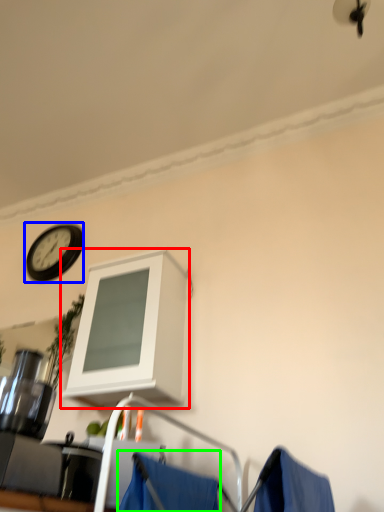
Question: Considering the real-world distances, which object is closest to cabinetry (highlighted by a red box)? wall clock (highlighted by a blue box) or curtain (highlighted by a green box).

Choices:
 (A) wall clock
 (B) curtain

Answer: (B)